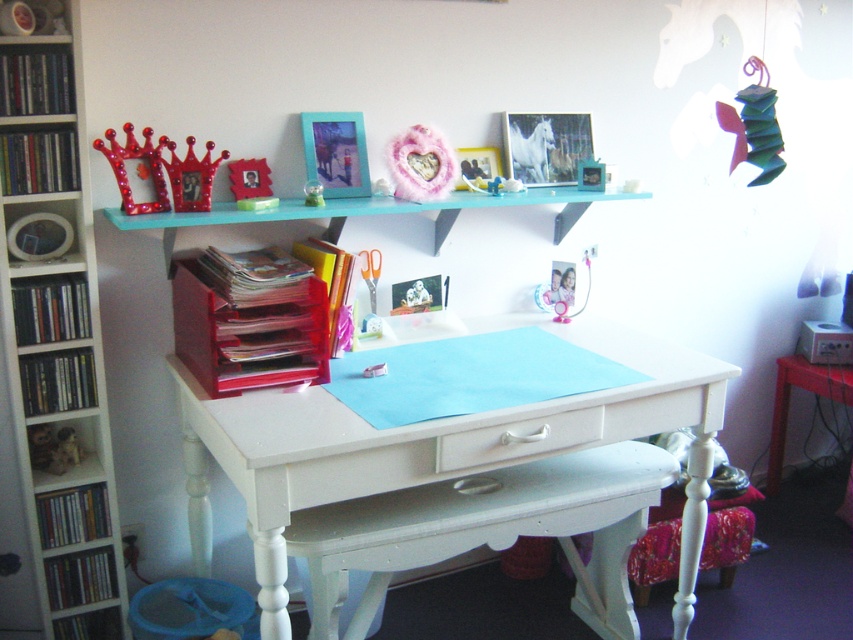
Question: Which point is farther from the camera taking this photo?

Choices:
 (A) (50, 177)
 (B) (64, 369)
 (C) (316, 141)

Answer: (C)

Question: Is shiny red crown at upper left above matte plastic photo frame at center?

Choices:
 (A) no
 (B) yes

Answer: (B)

Question: Estimate the real-world distances between objects in this image. Which object is farther from the wooden shelf at lower left?

Choices:
 (A) matte plastic picture frame at upper center
 (B) matte plastic shelf at left
 (C) white glossy table at center

Answer: (A)

Question: Can you confirm if matte plastic shelf at left is bigger than fluffy pink heart at upper center?

Choices:
 (A) yes
 (B) no

Answer: (B)

Question: Which point is closer to the camera taking this photo?

Choices:
 (A) (483, 449)
 (B) (207, 161)

Answer: (A)

Question: Can you confirm if white glossy table at center is wider than metallic silver toy at lower left?

Choices:
 (A) no
 (B) yes

Answer: (B)